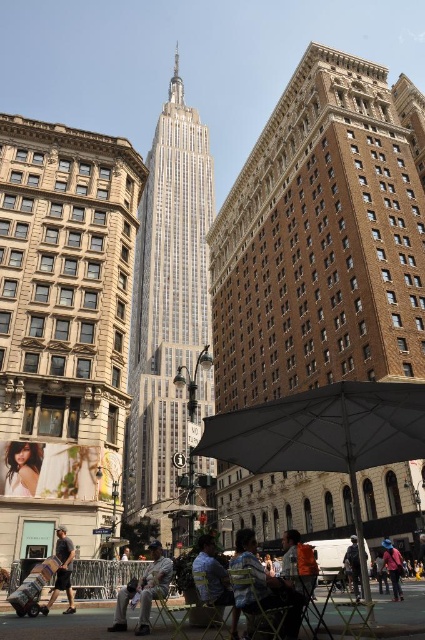
Locate an element on the screen. This screenshot has height=640, width=425. dark gray fabric bag at lower left is located at coordinates (62, 572).

Which is more to the left, dark gray fabric bag at lower left or blue denim jeans at center?

Positioned to the left is dark gray fabric bag at lower left.

Which is in front, point (70, 611) or point (388, 563)?

Positioned in front is point (70, 611).

Locate an element on the screen. dark gray fabric bag at lower left is located at coordinates (62, 572).

At what (x,y) coordinates should I click in order to perform the action: click on gray stone skyscraper at center. Please return your answer as a coordinate pair (x, y). Image resolution: width=425 pixels, height=640 pixels. Looking at the image, I should click on (167, 305).

Measure the distance between gray stone skyscraper at center and gray fabric umbrella at lower center.

gray stone skyscraper at center is 237.83 feet away from gray fabric umbrella at lower center.

Locate an element on the screen. The height and width of the screenshot is (640, 425). gray stone skyscraper at center is located at coordinates (167, 305).

Does camouflage-patterned shirt at center have a greater height compared to orange fabric chair at lower center?

Incorrect, camouflage-patterned shirt at center's height is not larger of orange fabric chair at lower center's.

The height and width of the screenshot is (640, 425). I want to click on camouflage-patterned shirt at center, so click(x=214, y=579).

Between point (212, 570) and point (316, 566), which one is positioned behind?

The point (212, 570) is more distant.

Locate an element on the screen. This screenshot has width=425, height=640. camouflage-patterned shirt at center is located at coordinates (214, 579).